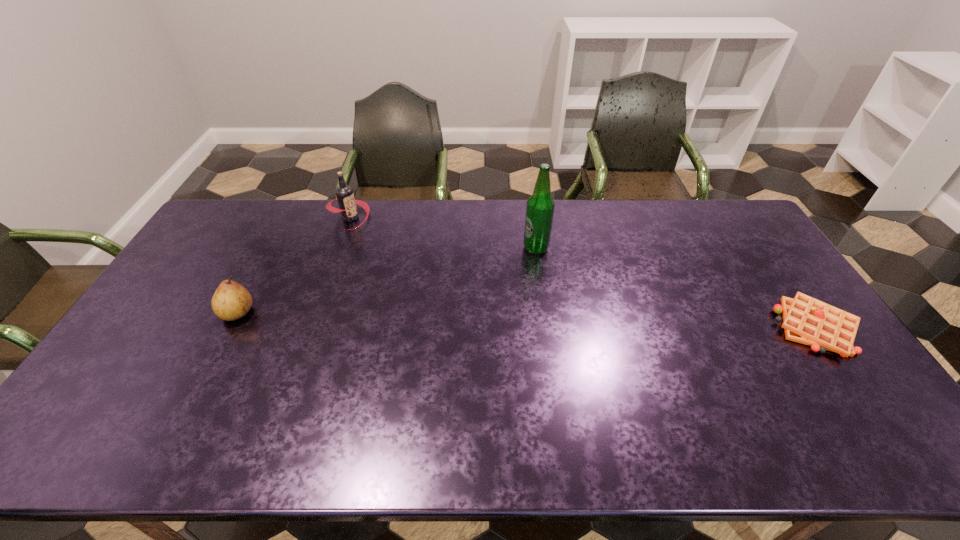
At what (x,y) coordinates should I click in order to perform the action: click on free space at the right edge of the desktop. Please return your answer as a coordinate pair (x, y). The width and height of the screenshot is (960, 540). Looking at the image, I should click on (726, 246).

Where is `vacant area at the far left corner`? Image resolution: width=960 pixels, height=540 pixels. vacant area at the far left corner is located at coordinates (219, 214).

The height and width of the screenshot is (540, 960). Identify the location of free space at the near right corner of the desktop. (860, 410).

Where is `free space that is in between the farthest object and the second object from right to left`? free space that is in between the farthest object and the second object from right to left is located at coordinates (443, 233).

At what (x,y) coordinates should I click in order to perform the action: click on free spot between the farthest object and the pear. Please return your answer as a coordinate pair (x, y). The width and height of the screenshot is (960, 540). Looking at the image, I should click on (294, 265).

Find the location of a particular element. The image size is (960, 540). free space that is in between the shortest object and the beer bottle is located at coordinates (676, 288).

At what (x,y) coordinates should I click in order to perform the action: click on free point between the second object from right to left and the shortest object. Please return your answer as a coordinate pair (x, y). Looking at the image, I should click on (676, 288).

You are a GUI agent. You are given a task and a screenshot of the screen. Output one action in this format:
    pyautogui.click(x=<x>, y=<y>)
    Task: Click on the free space between the root beer and the beer bottle
    
    Given the screenshot: What is the action you would take?
    pyautogui.click(x=443, y=233)

You are a GUI agent. You are given a task and a screenshot of the screen. Output one action in this format:
    pyautogui.click(x=<x>, y=<y>)
    Task: Click on the free point between the waffle and the third object from left to right
    The image size is (960, 540).
    Given the screenshot: What is the action you would take?
    pyautogui.click(x=676, y=288)

This screenshot has height=540, width=960. In order to click on free spot between the tallest object and the second shortest object in this screenshot , I will do `click(387, 280)`.